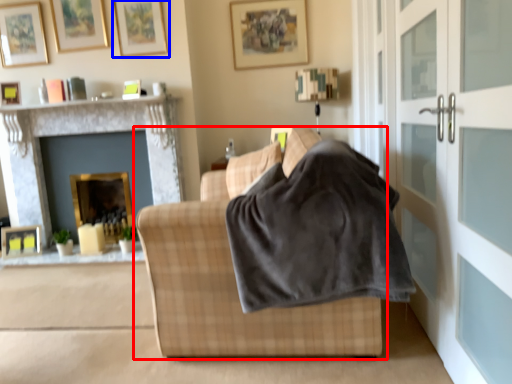
Question: Which object is closer to the camera taking this photo, studio couch (highlighted by a red box) or picture frame (highlighted by a blue box)?

Choices:
 (A) studio couch
 (B) picture frame

Answer: (A)